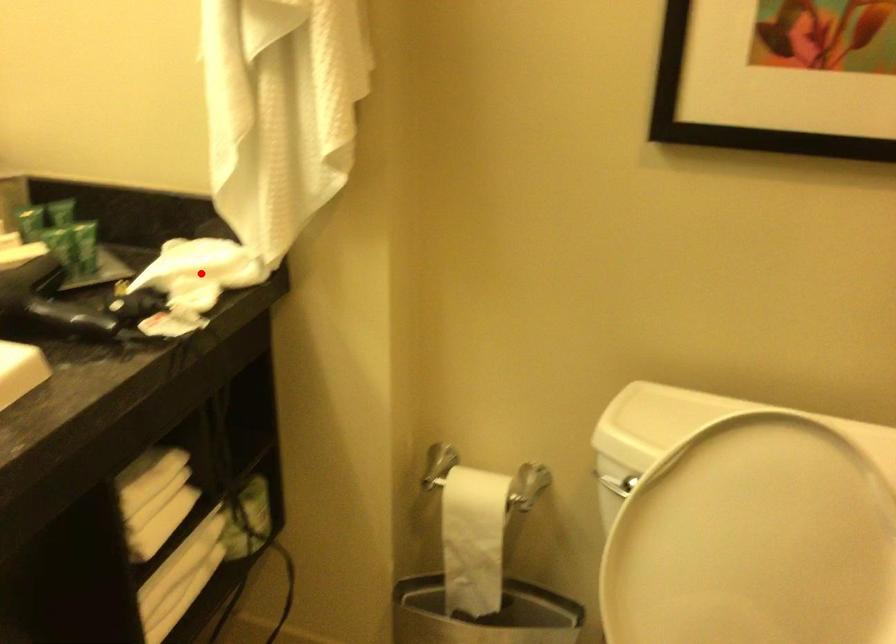
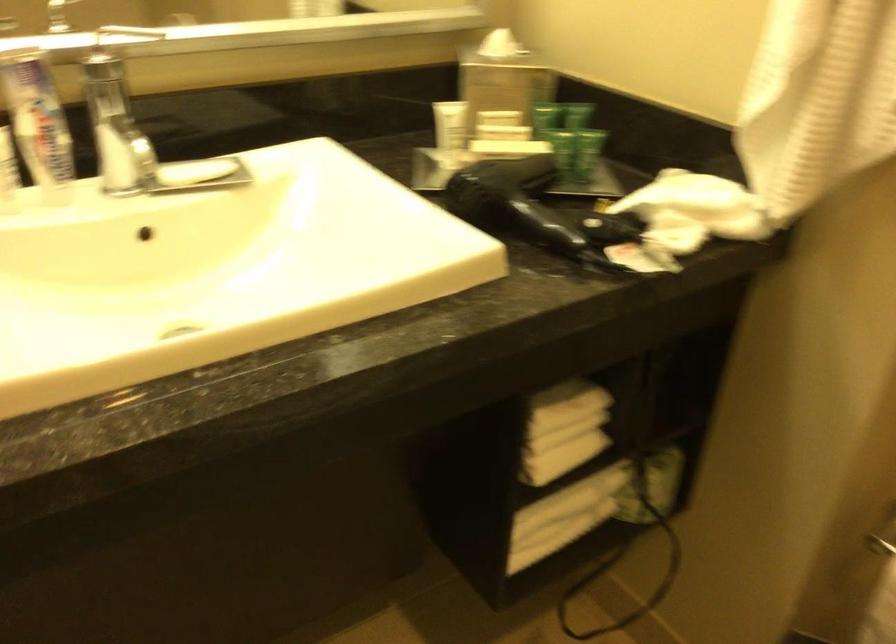
In the second image, find the point that corresponds to the highlighted location in the first image.

(694, 211)